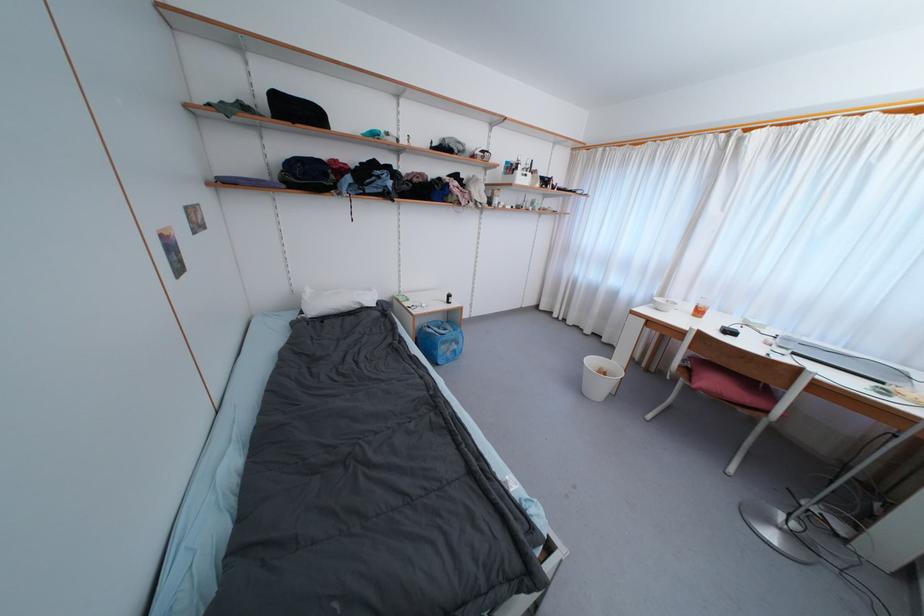
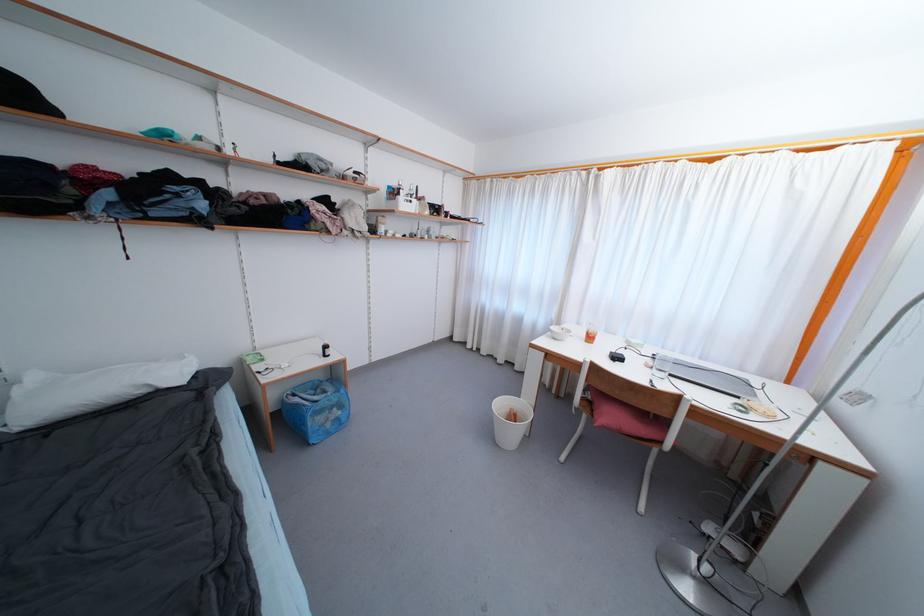
Question: The camera is either moving clockwise (left) or counter-clockwise (right) around the object. The first image is from the beginning of the video and the second image is from the end. Is the camera moving left or right when shooting the video?

Choices:
 (A) Left
 (B) Right

Answer: (A)